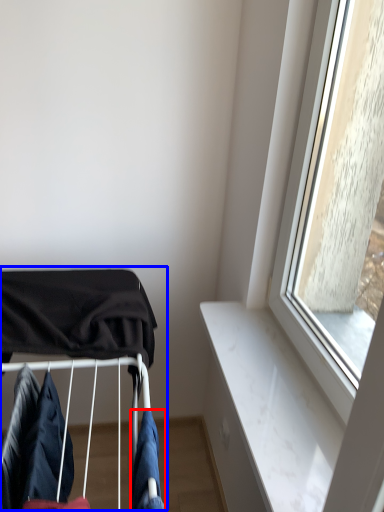
Question: Which of the following is the closest to the observer, clothing (highlighted by a red box) or baby carriage (highlighted by a blue box)?

Choices:
 (A) clothing
 (B) baby carriage

Answer: (A)